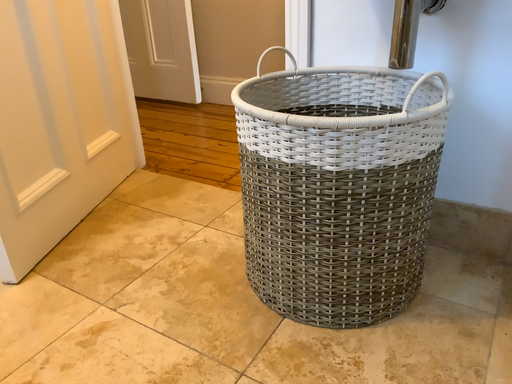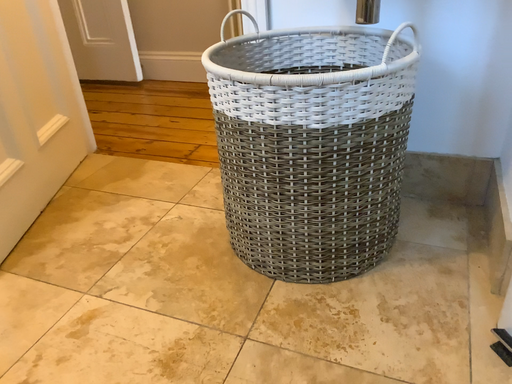
Question: How did the camera likely rotate when shooting the video?

Choices:
 (A) rotated right
 (B) rotated left

Answer: (A)